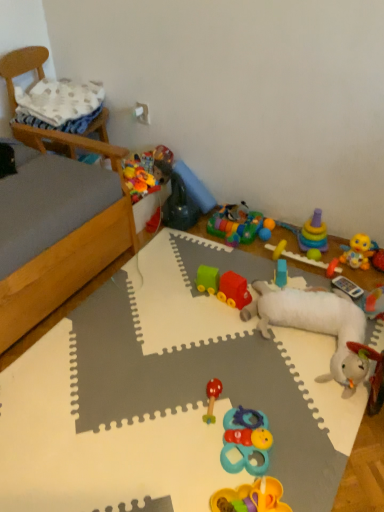
The width and height of the screenshot is (384, 512). Find the location of `free space in front of rubberized green toy at center, positioned as the 1th toy in top-to-bottom order`. free space in front of rubberized green toy at center, positioned as the 1th toy in top-to-bottom order is located at coordinates (185, 242).